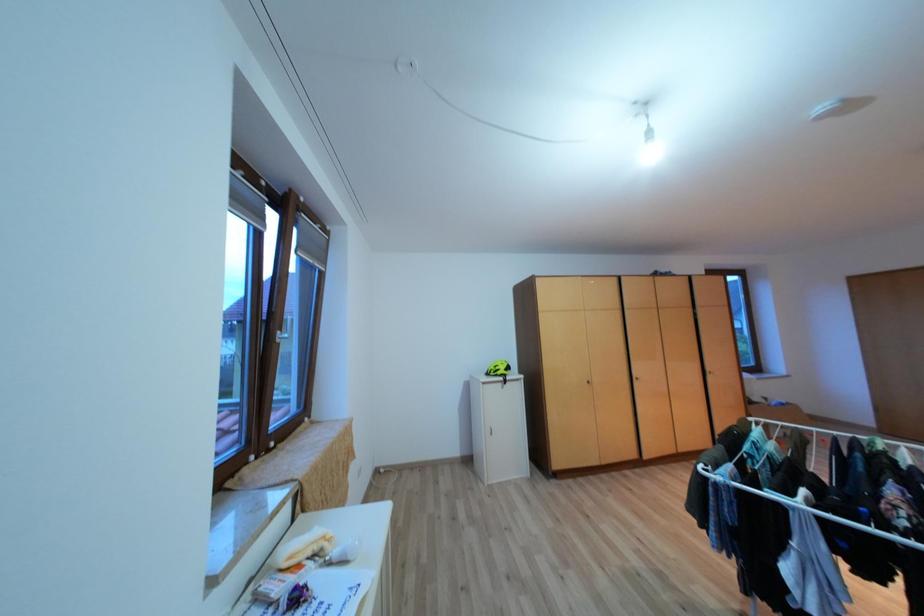
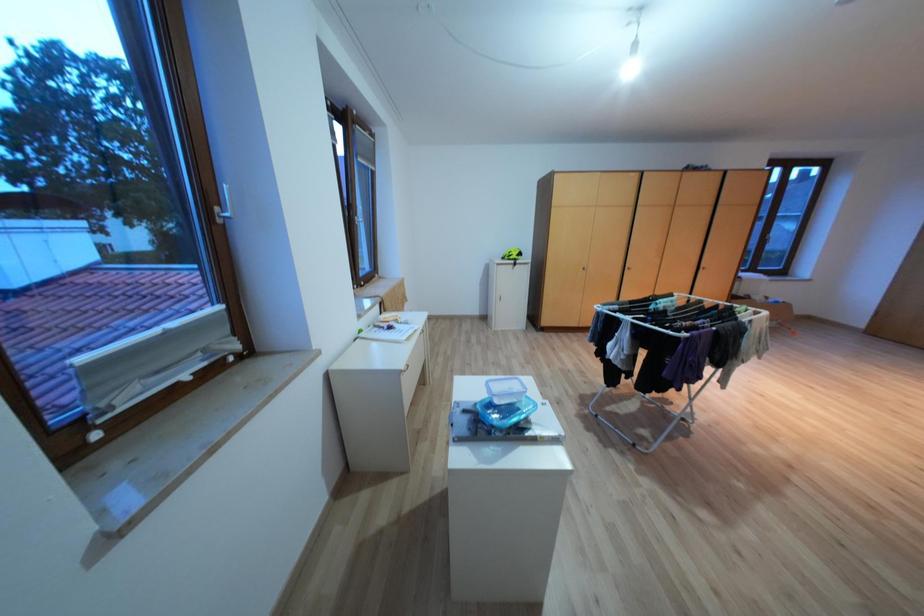
What movement of the cameraman would produce the second image?

The cameraman walked toward right, backward.